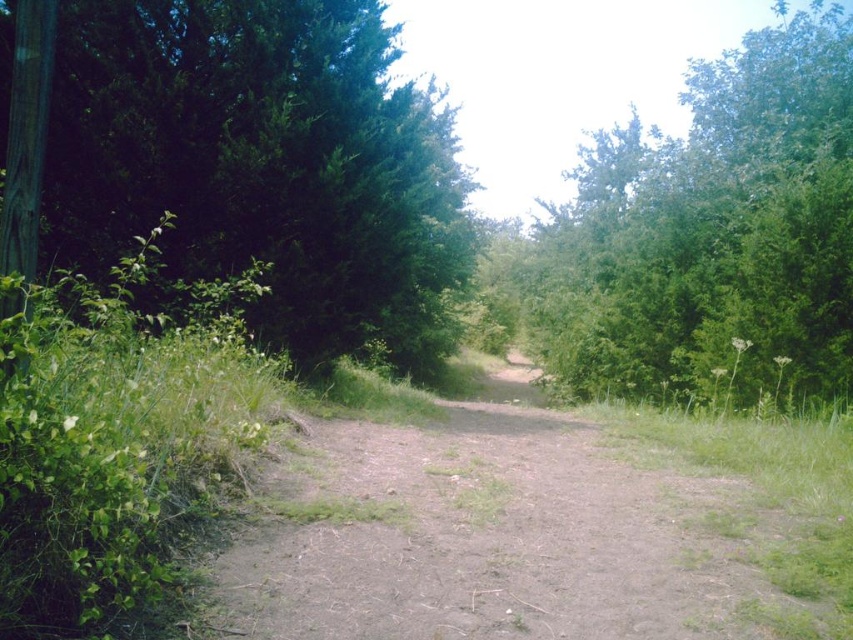
You are a hiker standing at the point marked by the coordinate point (x=264, y=164) in a forest. You want to reach a clearing that is located to the east of the green leafy tree at left. Which direction should you head from your current position?

The point (x=264, y=164) marks the green leafy tree at left. To reach the clearing east of it, you should head east from your current position.

You are a hiker carrying a 2.5 meter wide tent. You come across the brown dirt track at center and the green leafy tree at upper right. Which one has a smaller width?

The brown dirt track at center has a smaller width than the green leafy tree at upper right according to the description.

You are a hiker standing at the starting point of your journey. You see the brown dirt track at center in front of you. If you walk straight ahead along the direction of the track, where will you end up? Please answer based on the scene description.

The brown dirt track at center curves gently into the distance and disappears amidst the dense foliage, so walking straight ahead along the track would lead you deeper into the forest where the path becomes obscured by trees.